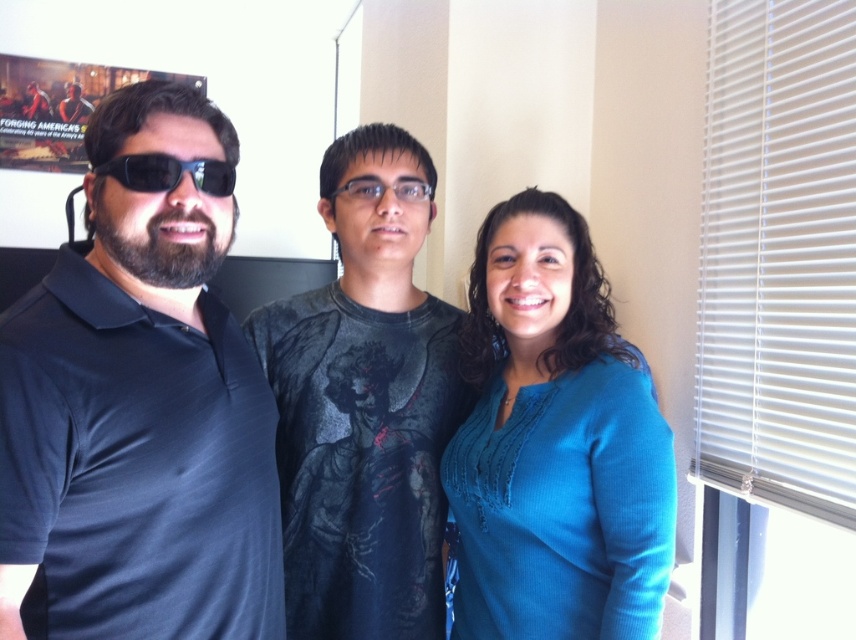
Question: Is dark gray printed shirt at center below matte black goggles at left?

Choices:
 (A) yes
 (B) no

Answer: (A)

Question: Is teal knit sweater at center closer to the viewer compared to dark gray printed shirt at center?

Choices:
 (A) yes
 (B) no

Answer: (A)

Question: Where is blue knit sweater at center located in relation to dark gray printed shirt at center in the image?

Choices:
 (A) left
 (B) right

Answer: (A)

Question: Among these objects, which one is nearest to the camera?

Choices:
 (A) dark gray printed shirt at center
 (B) teal knit sweater at center
 (C) matte black polo shirt at left
 (D) matte black goggles at left

Answer: (C)

Question: Which point appears farthest from the camera in this image?

Choices:
 (A) (247, 506)
 (B) (556, 230)
 (C) (28, 573)

Answer: (B)

Question: Which point is farther from the camera taking this photo?

Choices:
 (A) (535, 189)
 (B) (428, 196)
 (C) (215, 168)
 (D) (428, 568)

Answer: (B)